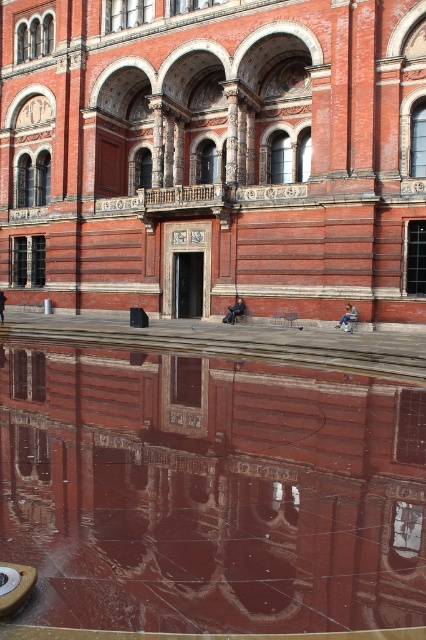
Question: Which of the following is the closest to the observer?

Choices:
 (A) (353, 134)
 (B) (186, 499)

Answer: (B)

Question: Is smooth stone plaza at center positioned at the back of smooth reflective water at center?

Choices:
 (A) yes
 (B) no

Answer: (A)

Question: Observing the image, what is the correct spatial positioning of smooth stone plaza at center in reference to smooth reflective water at center?

Choices:
 (A) above
 (B) below

Answer: (A)

Question: Can you confirm if smooth stone plaza at center is thinner than smooth reflective water at center?

Choices:
 (A) yes
 (B) no

Answer: (B)